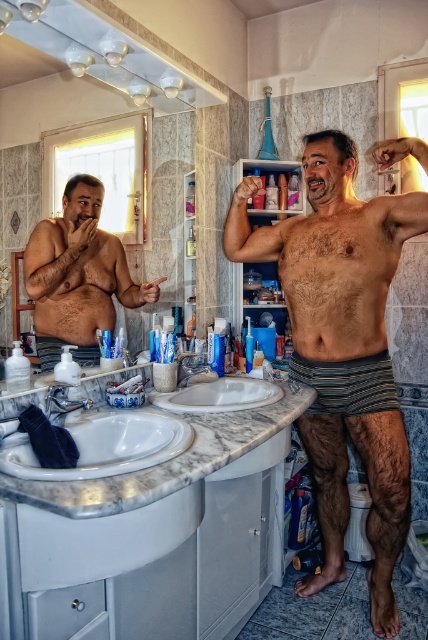
Which is more to the right, matte black torso at left or white glossy sink at lower left?

From the viewer's perspective, white glossy sink at lower left appears more on the right side.

Is matte black torso at left taller than white glossy sink at lower left?

Indeed, matte black torso at left has a greater height compared to white glossy sink at lower left.

Where is `matte black torso at left`? The image size is (428, 640). matte black torso at left is located at coordinates (77, 275).

Is striped cotton shorts at center to the left of matte black torso at left from the viewer's perspective?

Incorrect, striped cotton shorts at center is not on the left side of matte black torso at left.

Which is behind, point (365, 460) or point (29, 259)?

The point (365, 460) is behind.

This screenshot has width=428, height=640. I want to click on striped cotton shorts at center, so click(342, 348).

Is the position of striped cotton shorts at center less distant than that of white glossy sink at lower left?

That is False.

Looking at this image, can you confirm if striped cotton shorts at center is thinner than white glossy sink at lower left?

No, striped cotton shorts at center is not thinner than white glossy sink at lower left.

Does point (311, 349) lie in front of point (121, 451)?

No, it is not.

This screenshot has height=640, width=428. Find the location of `striped cotton shorts at center`. striped cotton shorts at center is located at coordinates (342, 348).